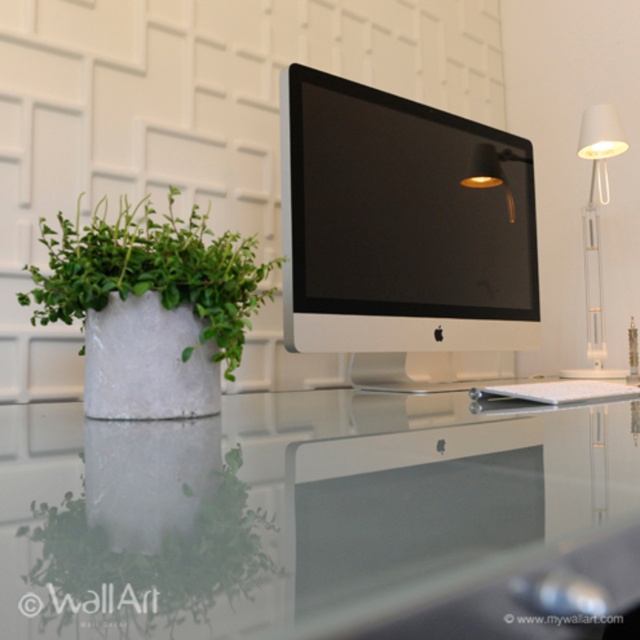
Question: Which object is farther from the camera taking this photo?

Choices:
 (A) green leafy plant at left
 (B) sleek silver monitor at center
 (C) transparent glass table at center

Answer: (B)

Question: Which point is farther to the camera?

Choices:
 (A) green leafy plant at left
 (B) transparent glass table at center

Answer: (A)

Question: Estimate the real-world distances between objects in this image. Which object is closer to the green leafy plant at left?

Choices:
 (A) white matte desk lamp at upper right
 (B) sleek silver monitor at center
 (C) transparent glass table at center

Answer: (C)

Question: Can you confirm if transparent glass table at center is positioned to the left of white matte desk lamp at upper right?

Choices:
 (A) yes
 (B) no

Answer: (A)

Question: Is green leafy plant at left positioned at the back of green concrete pot at left?

Choices:
 (A) no
 (B) yes

Answer: (A)

Question: Does green leafy plant at left have a greater width compared to white matte desk lamp at upper right?

Choices:
 (A) no
 (B) yes

Answer: (A)